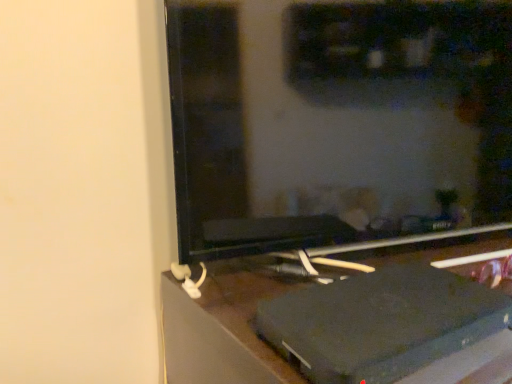
You are a GUI agent. You are given a task and a screenshot of the screen. Output one action in this format:
    pyautogui.click(x=<x>, y=<y>)
    Task: Click on the free point below black matte computer monitor at center (from a real-world perspective)
    The image size is (512, 384).
    Given the screenshot: What is the action you would take?
    pyautogui.click(x=369, y=263)